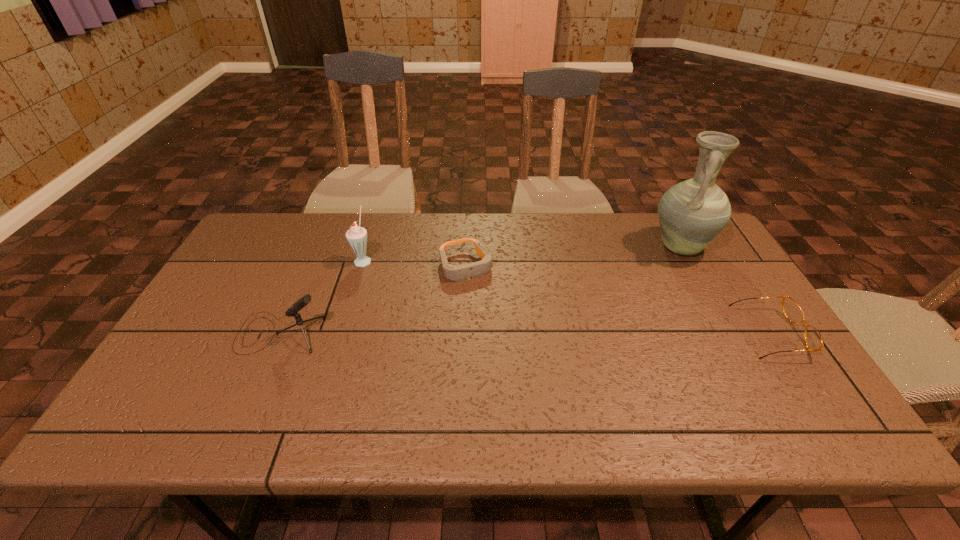
Identify the location of object that is the fourth nearest to the fourth shortest object. (792, 311).

Locate an element on the screen. object that ranks as the third closest to the pitcher is located at coordinates click(356, 236).

Find the location of a particular element. vacant region that satisfies the following two spatial constraints: 1. on the front side of the goggles; 2. on the front-facing side of the spectacles is located at coordinates (463, 333).

This screenshot has height=540, width=960. Identify the location of vacant area in the image that satisfies the following two spatial constraints: 1. on the front side of the third object from right to left; 2. on the front-facing side of the spectacles. (463, 333).

Locate an element on the screen. The height and width of the screenshot is (540, 960). vacant space that satisfies the following two spatial constraints: 1. on the front side of the spectacles; 2. on the front-facing side of the third object from right to left is located at coordinates (463, 333).

You are a GUI agent. You are given a task and a screenshot of the screen. Output one action in this format:
    pyautogui.click(x=<x>, y=<y>)
    Task: Click on the vacant area in the image that satisfies the following two spatial constraints: 1. on the front side of the spectacles; 2. on the front-facing side of the fourth object from right to left
    The height and width of the screenshot is (540, 960).
    Given the screenshot: What is the action you would take?
    pyautogui.click(x=341, y=333)